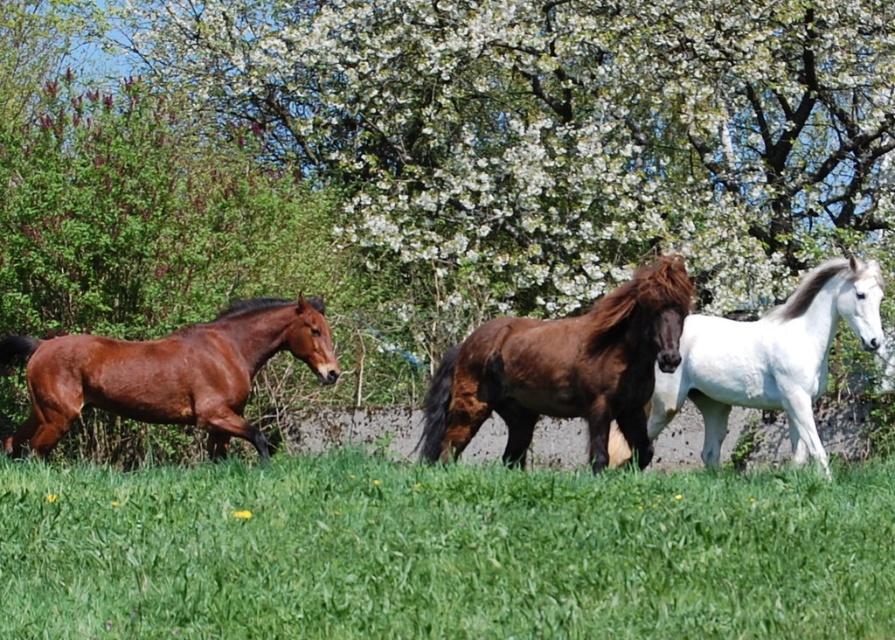
You are standing at the point marked by the coordinates point [442,552]. What is the color of the ground beneath your feet?

The point [442,552] marks green grass at center, so the ground beneath your feet is green.

You are a farmer who needs to separate the shiny brown horse at left and the white glossy horse at right with a fence. What is the minimum length of the fence required to separate them?

The minimum length of the fence required to separate the shiny brown horse at left and the white glossy horse at right is 10.82 feet, as they are 10.82 feet apart.